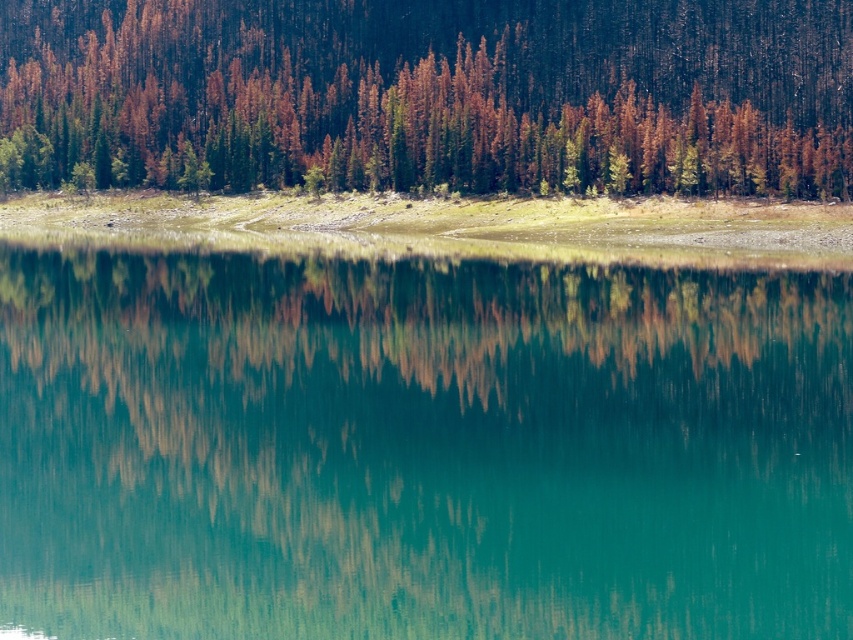
Between green glassy water at center and brown/dried wood trees at upper center, which one appears on the right side from the viewer's perspective?

From the viewer's perspective, green glassy water at center appears more on the right side.

Between green glassy water at center and brown/dried wood trees at upper center, which one appears on the left side from the viewer's perspective?

brown/dried wood trees at upper center is more to the left.

Between point (38, 524) and point (219, 144), which one is positioned behind?

The point (219, 144) is behind.

Locate an element on the screen. The image size is (853, 640). green glassy water at center is located at coordinates (421, 449).